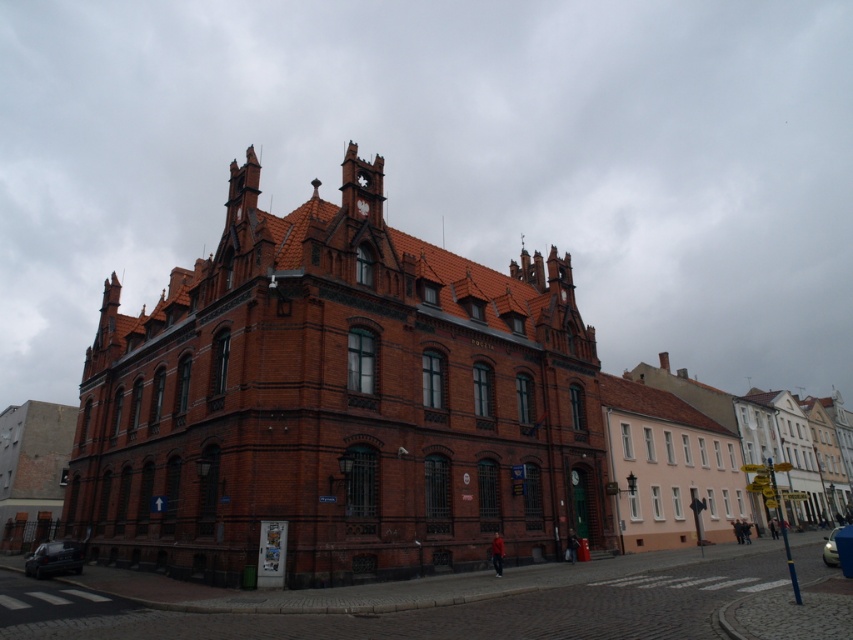
Question: Does shiny black car at lower left appear on the right side of matte brown clock at center?

Choices:
 (A) yes
 (B) no

Answer: (B)

Question: Which of the following is the closest to the observer?

Choices:
 (A) (364, 198)
 (B) (53, 566)

Answer: (B)

Question: Is white glossy clock at upper center to the left of matte brown clock at center from the viewer's perspective?

Choices:
 (A) no
 (B) yes

Answer: (B)

Question: Which point is farther to the camera?

Choices:
 (A) (838, 563)
 (B) (364, 202)

Answer: (B)

Question: Estimate the real-world distances between objects in this image. Which object is farther from the white glossy clock at upper center?

Choices:
 (A) shiny silver car at lower right
 (B) white metal clock at upper center

Answer: (A)

Question: Can you confirm if white metal clock at upper center is positioned below matte brown clock at center?

Choices:
 (A) yes
 (B) no

Answer: (B)